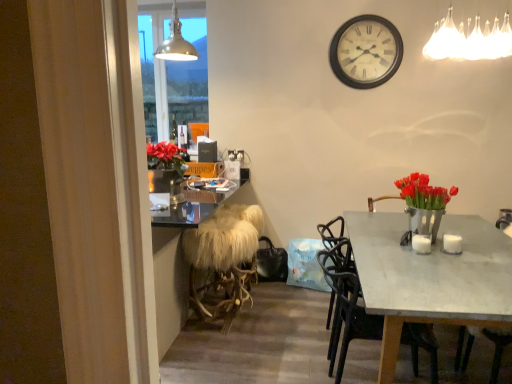
Locate an element on the screen. vacant area that is situated to the right of white glossy coffee cup at right, the 1th coffee cup in the left-to-right sequence is located at coordinates (442, 244).